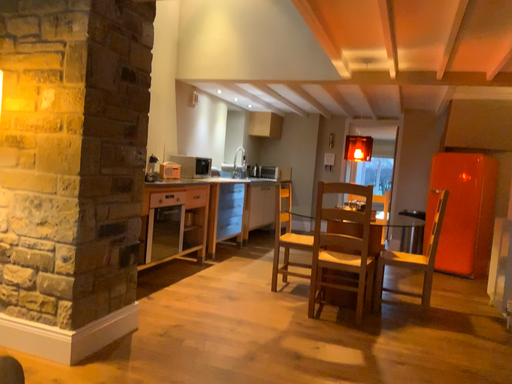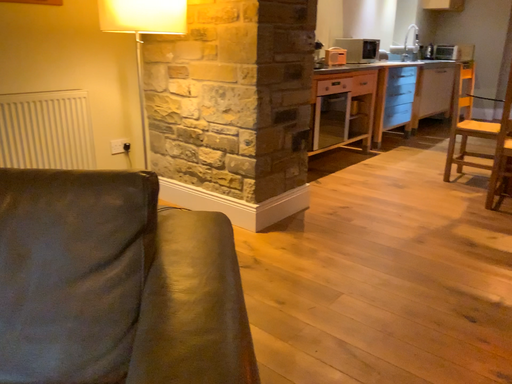
Question: Which way did the camera rotate in the video?

Choices:
 (A) rotated downward
 (B) rotated upward

Answer: (A)